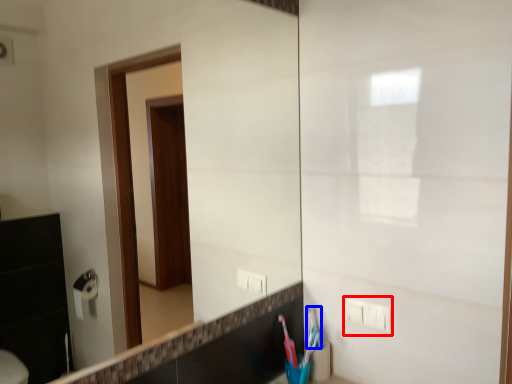
Question: Which of the following is the closest to the observer, electric outlet (highlighted by a red box) or toothbrush (highlighted by a blue box)?

Choices:
 (A) electric outlet
 (B) toothbrush

Answer: (A)